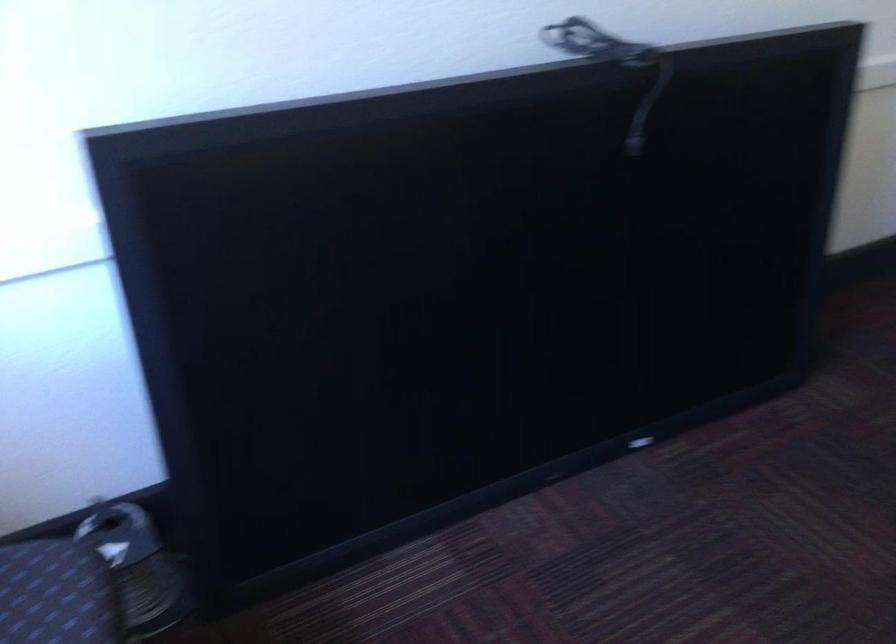
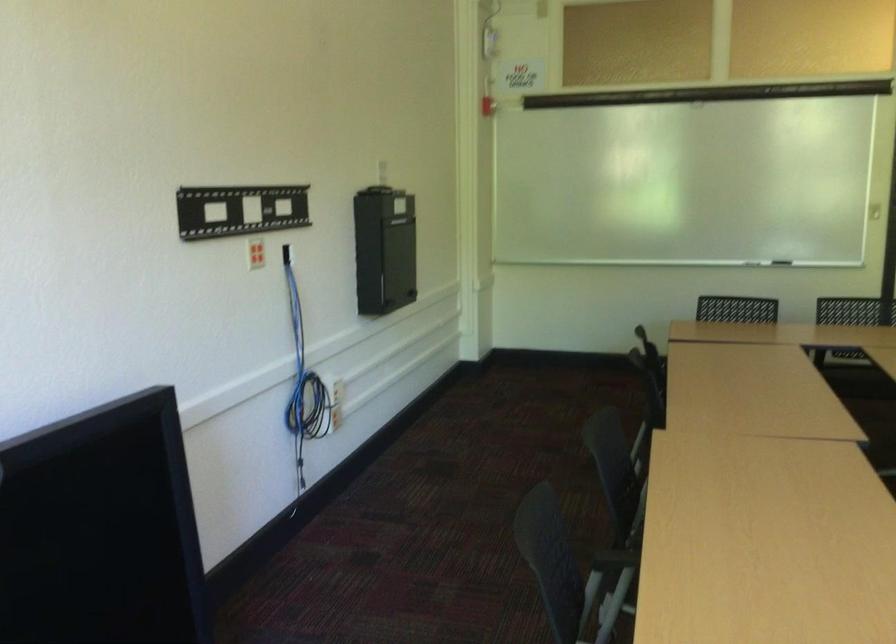
Question: Based on the continuous images, in which direction is the camera rotating? Reply with the corresponding letter.

Choices:
 (A) Left
 (B) Right
 (C) Up
 (D) Down

Answer: (B)